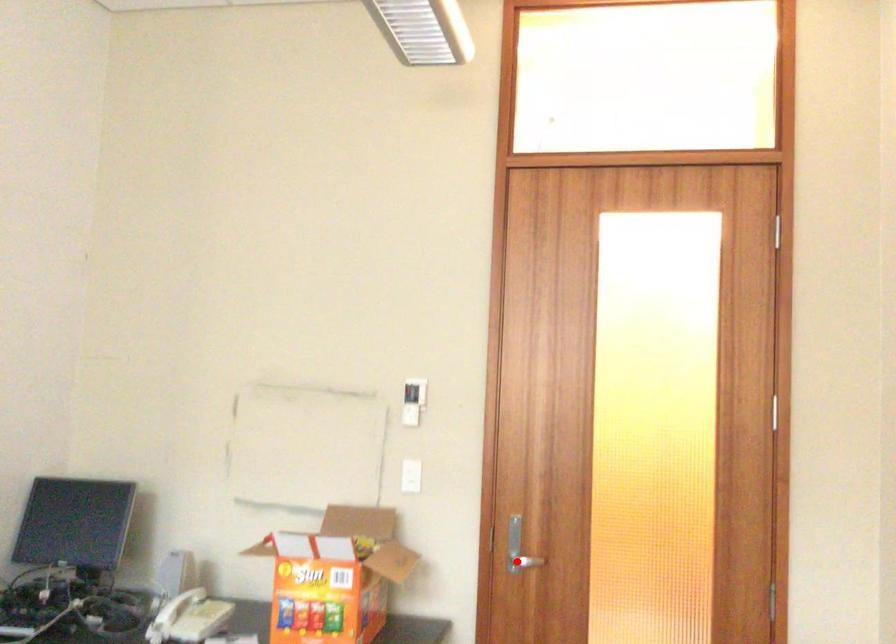
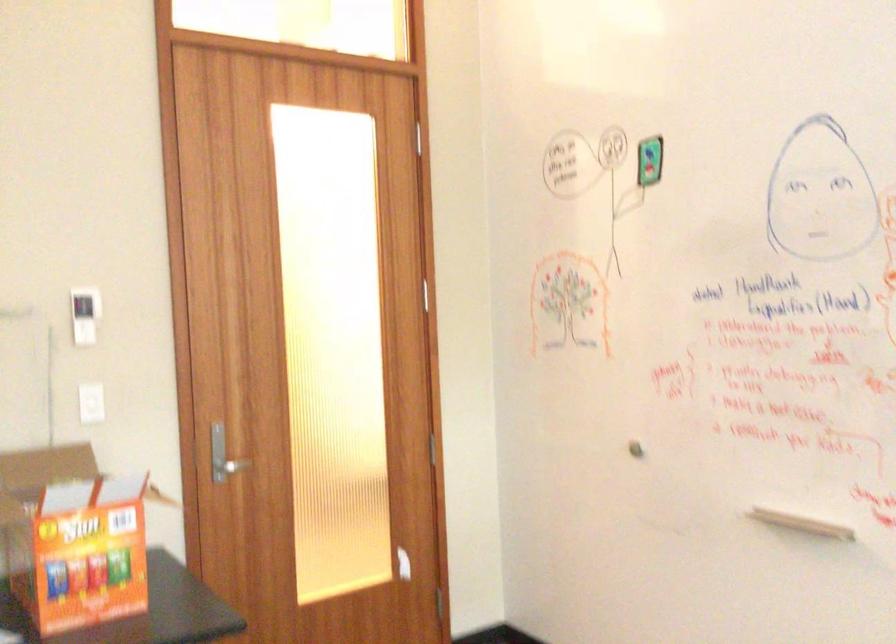
Locate, in the second image, the point that corresponds to the highlighted location in the first image.

(226, 466)